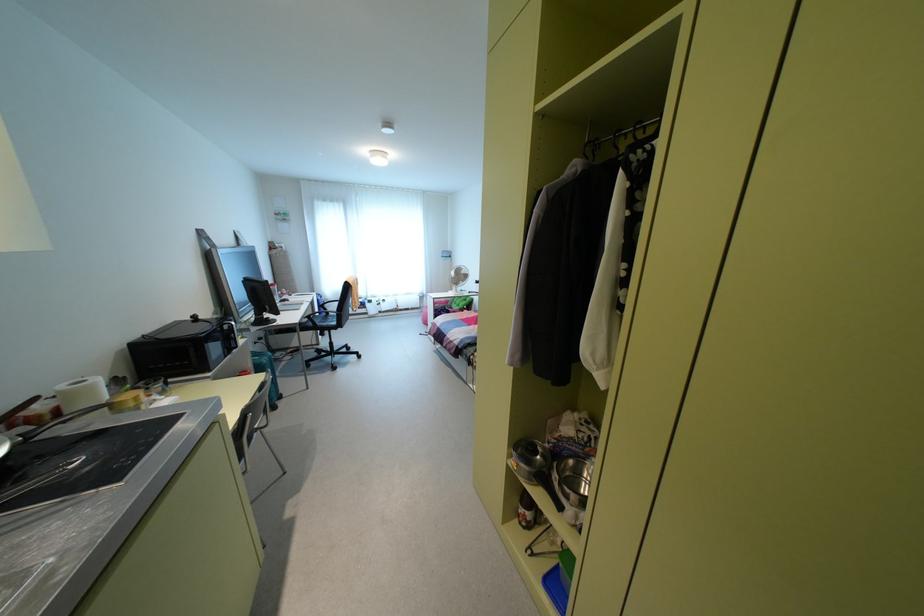
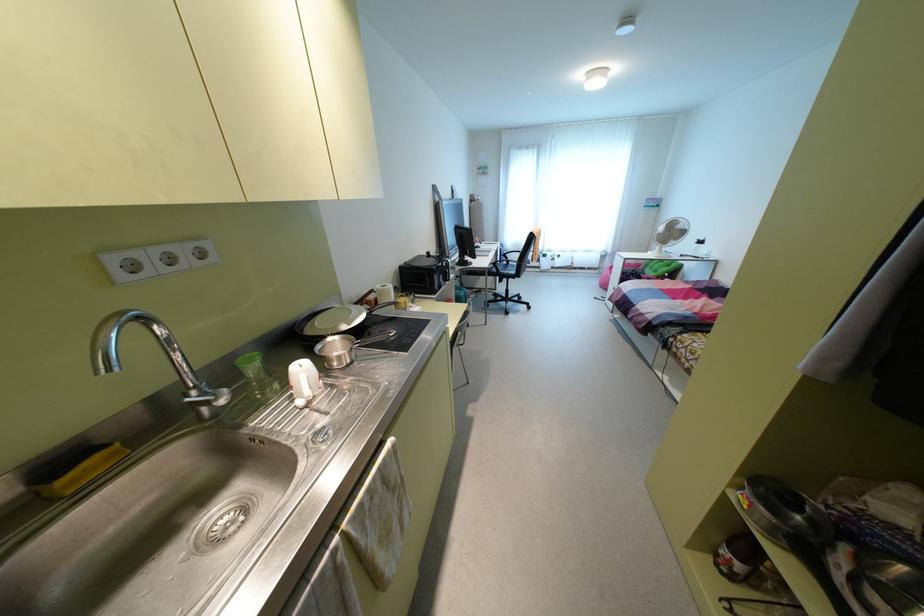
In the second image, find the point that corresponds to point 333,323 in the first image.

(513, 272)